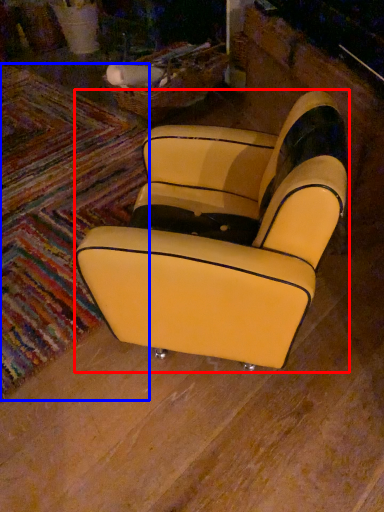
Question: Which object is further to the camera taking this photo, chair (highlighted by a red box) or mat (highlighted by a blue box)?

Choices:
 (A) chair
 (B) mat

Answer: (B)